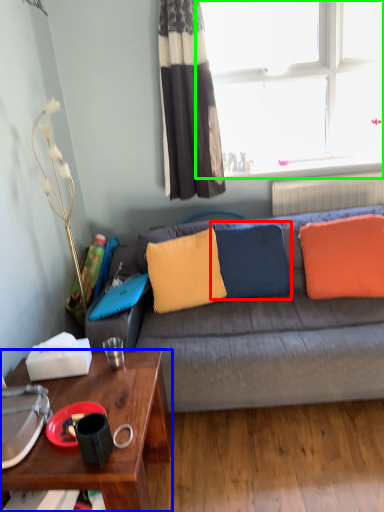
Question: Considering the real-world distances, which object is closest to pillow (highlighted by a red box)? desk (highlighted by a blue box) or window (highlighted by a green box).

Choices:
 (A) desk
 (B) window

Answer: (A)